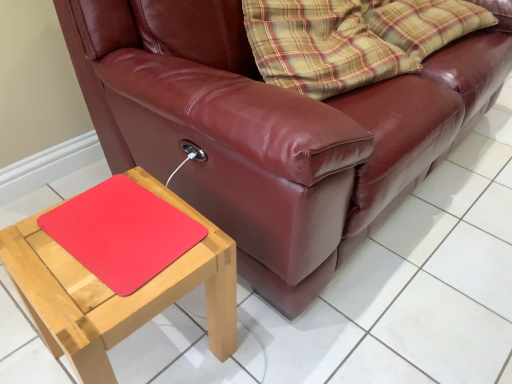
Locate an element on the screen. blank space above natural wood table at lower left (from a real-world perspective) is located at coordinates (114, 243).